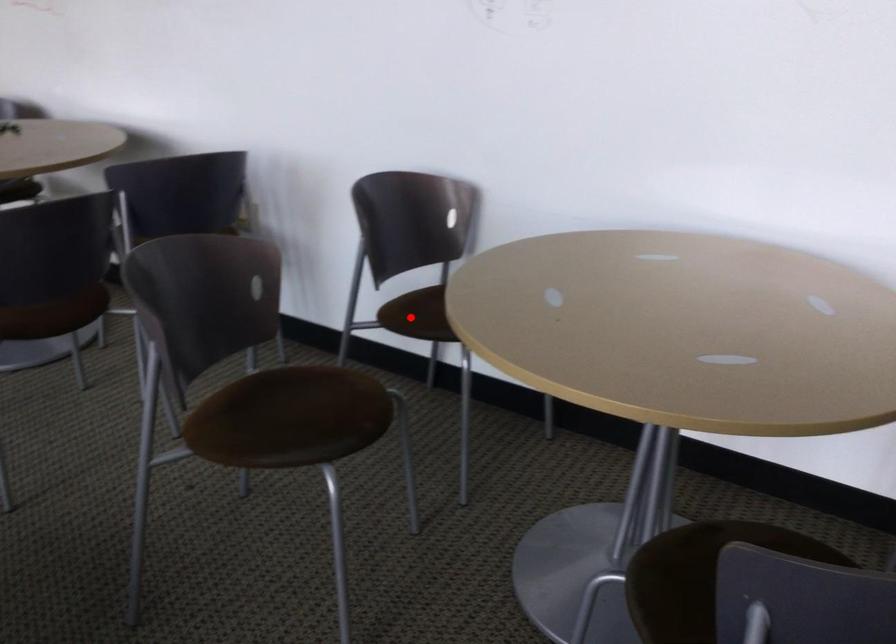
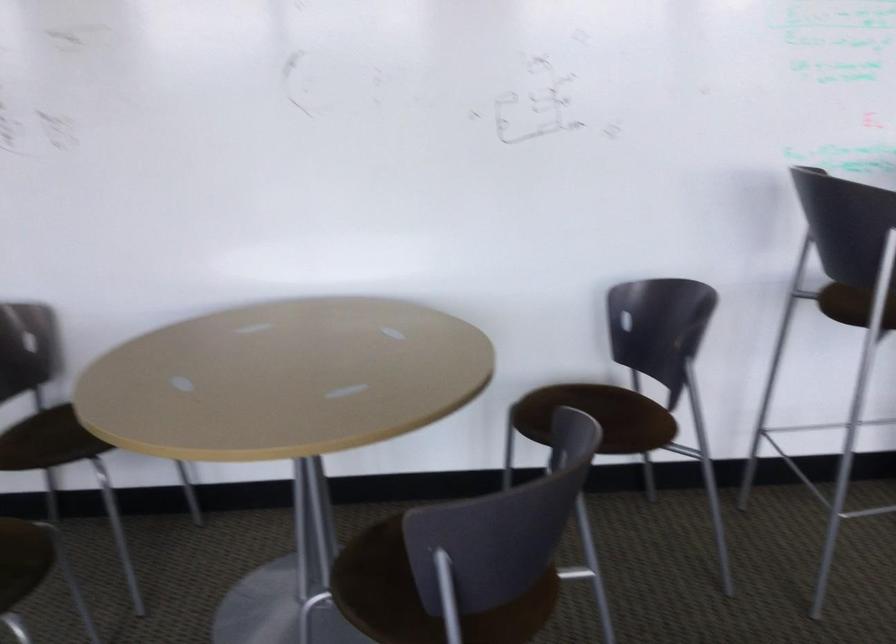
Locate, in the second image, the point that corresponds to the highlighted location in the first image.

(26, 442)